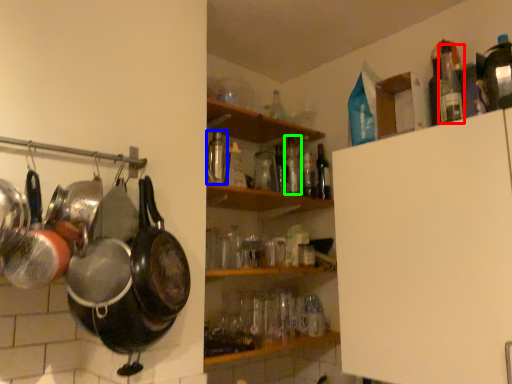
Question: Considering the real-world distances, which object is closest to bottle (highlighted by a red box)? bottle (highlighted by a blue box) or bottle (highlighted by a green box).

Choices:
 (A) bottle
 (B) bottle

Answer: (B)